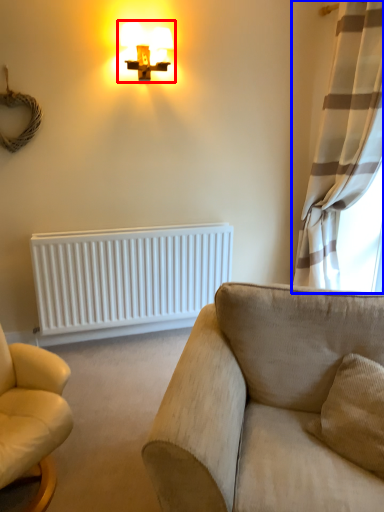
Question: Among these objects, which one is farthest to the camera, lamp (highlighted by a red box) or curtain (highlighted by a blue box)?

Choices:
 (A) lamp
 (B) curtain

Answer: (A)